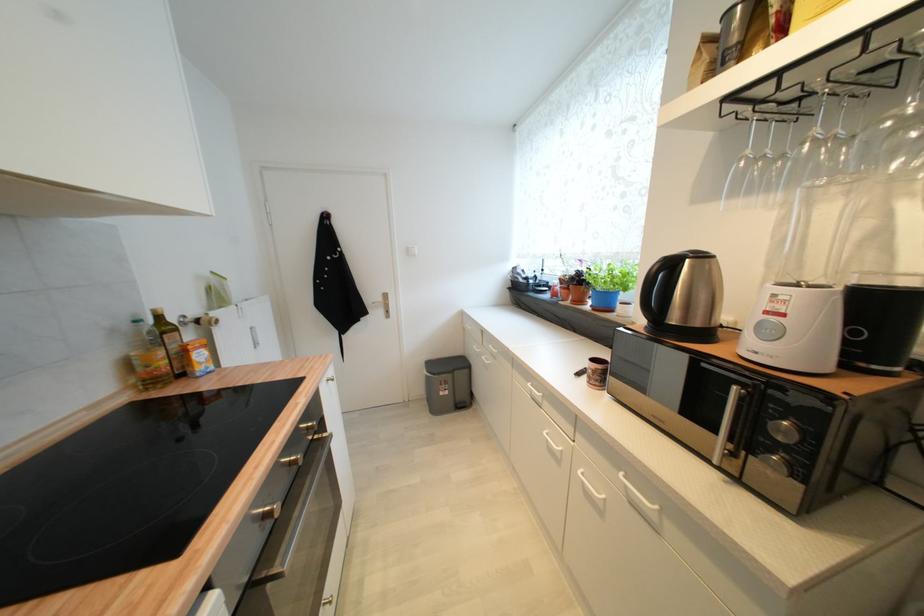
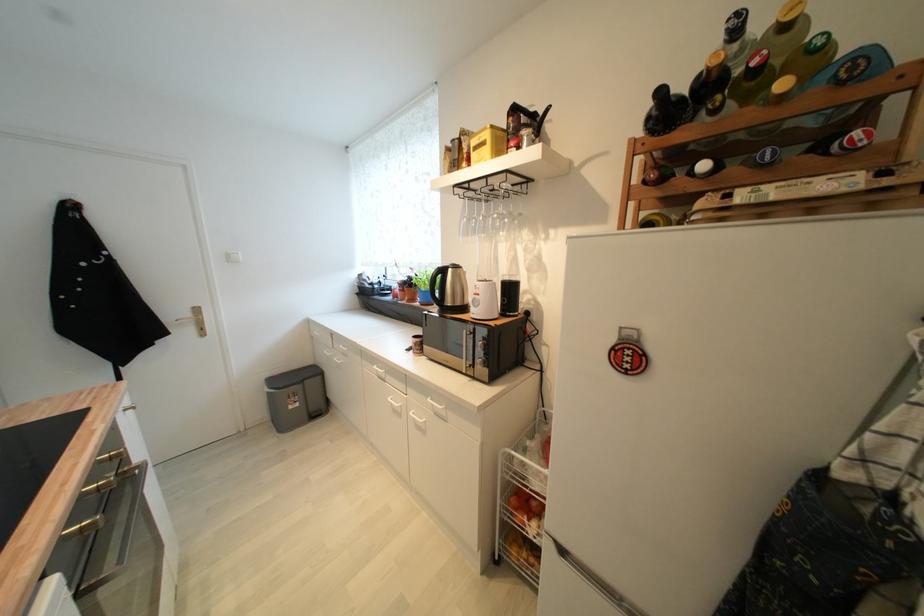
Where in the second image is the point corresponding to point (287, 565) from the first image?

(126, 564)